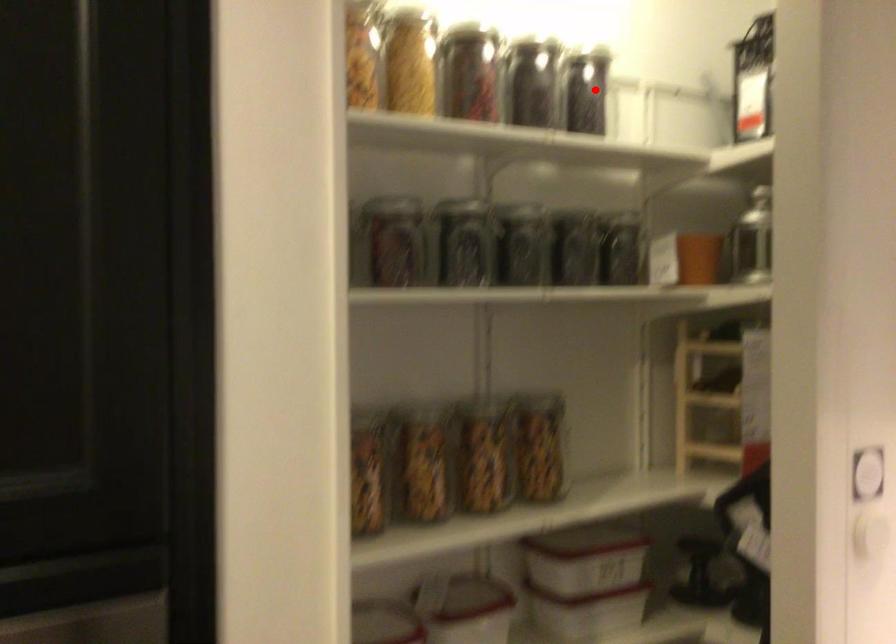
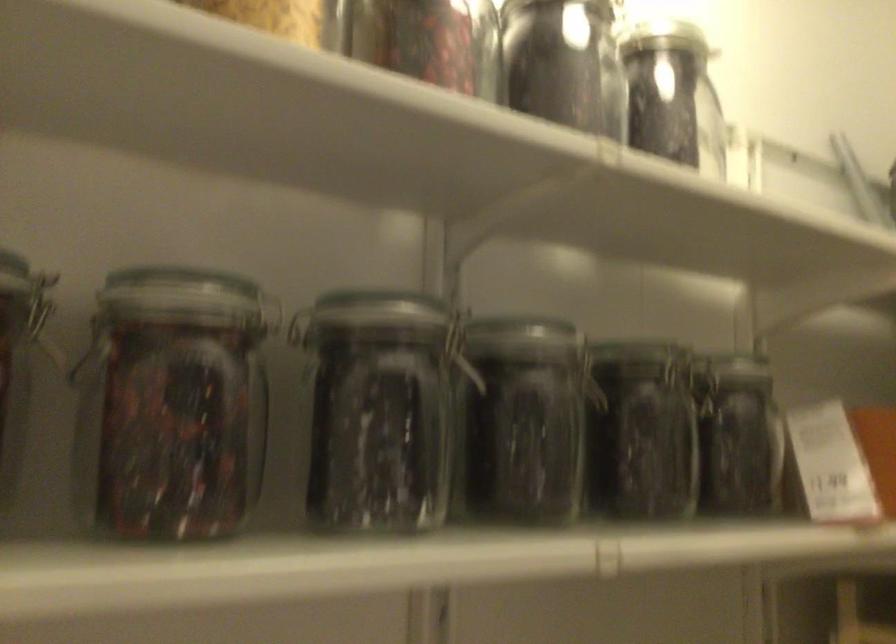
Question: I am providing you with two images of the same scene from different viewpoints. Image1 has a red point marked. In image2, the corresponding 3D location appears at what relative position? Reply with the corresponding letter.

Choices:
 (A) Closer
 (B) Farther

Answer: (A)